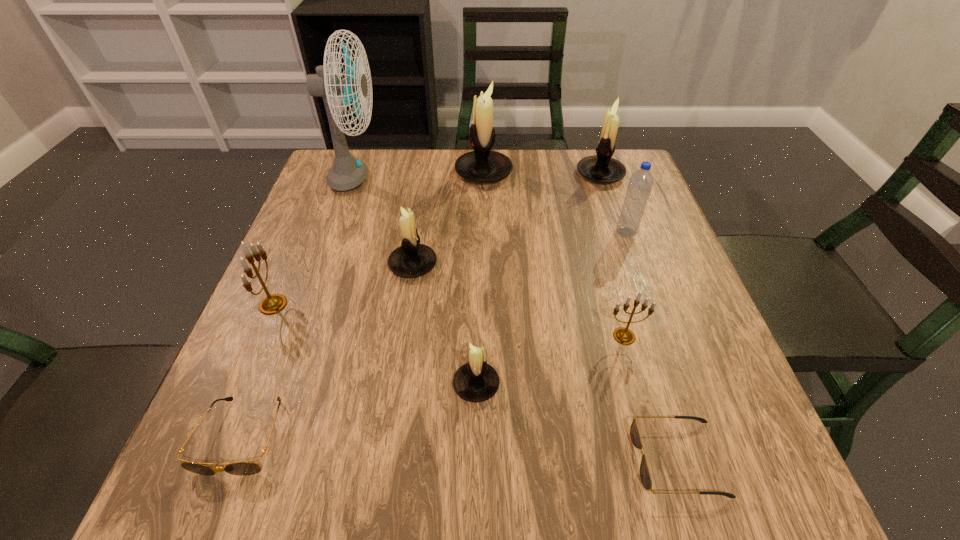
Identify the location of fan located in the left edge section of the desktop. This screenshot has height=540, width=960. (346, 173).

Where is `candelabrum that is at the left edge`? candelabrum that is at the left edge is located at coordinates (271, 304).

You are a GUI agent. You are given a task and a screenshot of the screen. Output one action in this format:
    pyautogui.click(x=<x>, y=<y>)
    Task: Click on the sunglasses at the left edge
    This screenshot has width=960, height=540.
    Given the screenshot: What is the action you would take?
    pyautogui.click(x=246, y=468)

Where is `water bottle located in the right edge section of the desktop`? The height and width of the screenshot is (540, 960). water bottle located in the right edge section of the desktop is located at coordinates (640, 184).

Identify the location of sunglasses present at the right edge. This screenshot has height=540, width=960. (645, 476).

Image resolution: width=960 pixels, height=540 pixels. I want to click on object present at the far left corner, so click(x=346, y=173).

At what (x,y) coordinates should I click in order to perform the action: click on object that is at the near left corner. Please return your answer as a coordinate pair (x, y). Looking at the image, I should click on (246, 468).

I want to click on object located in the far right corner section of the desktop, so click(601, 168).

Identify the location of object located in the near right corner section of the desktop. This screenshot has height=540, width=960. (645, 476).

In the image, there is a desktop. Where is `free region at the far edge`? free region at the far edge is located at coordinates (567, 150).